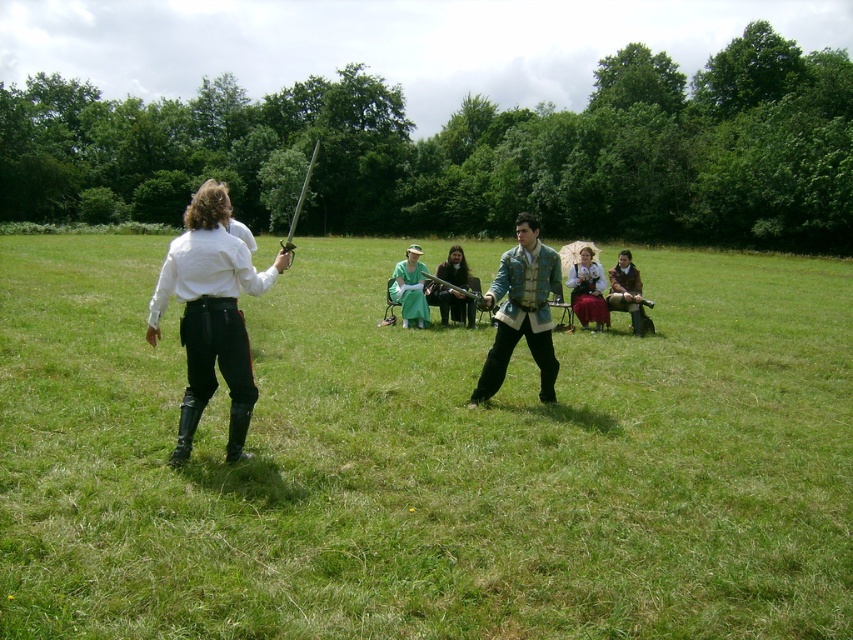
You are a costume designer preparing for a historical play. You need to ensure that the matte green dress at center and the polished silver sword at center can be placed on a display stand without overlapping. Given that the display stand is 6 feet wide, will the two items fit side by side?

The matte green dress at center and the polished silver sword at center are 6.65 feet apart, so they cannot fit on a 6 feet wide display stand without overlapping since the required space exceeds the stand width.

Consider the image. You are a photographer setting up a wide shot for the scene. You need to ensure both the white matte shirt at left and the matte green dress at center are fully visible in the frame. Based on their widths, which object should you prioritize positioning closer to the edge of the frame to avoid cropping?

The white matte shirt at left might be wider than matte green dress at center, so you should prioritize positioning the white matte shirt at left closer to the edge of the frame to avoid cropping.

You are a costume designer preparing for a historical play. You need to place the matte green dress at center and the polished silver sword at center on a mannequin. According to the scene, which item should be placed on the right side of the other?

The matte green dress at center should be placed on the right side of the polished silver sword at center because the description states that the matte green dress at center is positioned on the right side of the polished silver sword at center.